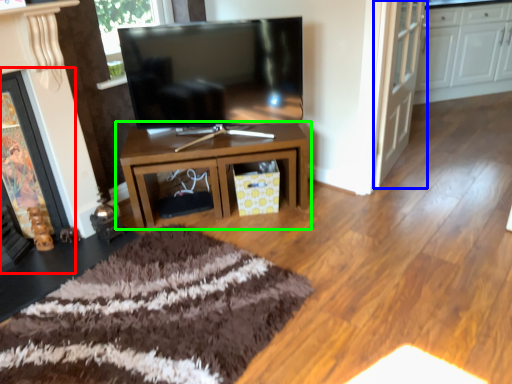
Question: Estimate the real-world distances between objects in this image. Which object is closer to fireplace (highlighted by a red box), door (highlighted by a blue box) or table (highlighted by a green box)?

Choices:
 (A) door
 (B) table

Answer: (B)